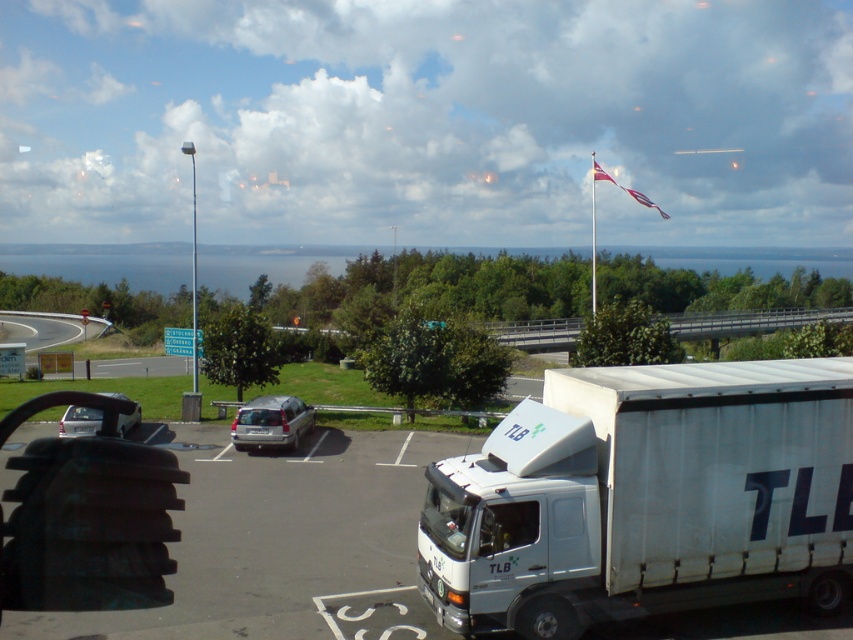
Question: Considering the real-world distances, which object is farthest from the gray asphalt road at lower left?

Choices:
 (A) red fabric flag at upper right
 (B) silver metallic hatchback at lower left
 (C) silver metallic van at center

Answer: (A)

Question: Among these objects, which one is farthest from the camera?

Choices:
 (A) white matte trailer truck at lower right
 (B) silver metallic hatchback at lower left
 (C) red fabric flag at upper right
 (D) gray asphalt road at lower left

Answer: (C)

Question: Observing the image, what is the correct spatial positioning of white matte trailer truck at lower right in reference to silver metallic van at center?

Choices:
 (A) right
 (B) left

Answer: (A)

Question: Is silver metallic hatchback at lower left above red fabric flag at upper right?

Choices:
 (A) yes
 (B) no

Answer: (B)

Question: Which point is closer to the camera?

Choices:
 (A) (61, 424)
 (B) (51, 317)
 (C) (520, 592)
 (D) (648, 204)

Answer: (C)

Question: Does white matte trailer truck at lower right have a smaller size compared to silver metallic van at center?

Choices:
 (A) yes
 (B) no

Answer: (B)